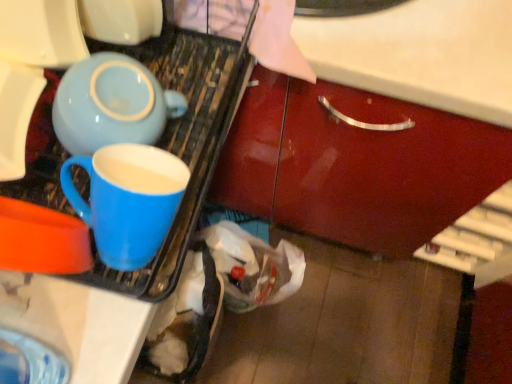
Question: In terms of width, does matte blue mug at left look wider or thinner when compared to matte ceramic mug at left?

Choices:
 (A) wide
 (B) thin

Answer: (A)

Question: Is point (176, 216) positioned closer to the camera than point (116, 233)?

Choices:
 (A) closer
 (B) farther

Answer: (B)

Question: Is matte blue mug at left inside the boundaries of matte ceramic mug at left, or outside?

Choices:
 (A) outside
 (B) inside

Answer: (A)

Question: From a real-world perspective, is matte ceramic mug at left positioned above or below matte blue mug at left?

Choices:
 (A) below
 (B) above

Answer: (B)

Question: Considering the positions of matte ceramic mug at left and matte blue mug at left in the image, is matte ceramic mug at left wider or thinner than matte blue mug at left?

Choices:
 (A) thin
 (B) wide

Answer: (A)

Question: Does point tap(128, 177) appear closer or farther from the camera than point tap(209, 114)?

Choices:
 (A) closer
 (B) farther

Answer: (A)

Question: Is matte ceramic mug at left in front of or behind matte blue mug at left in the image?

Choices:
 (A) front
 (B) behind

Answer: (A)